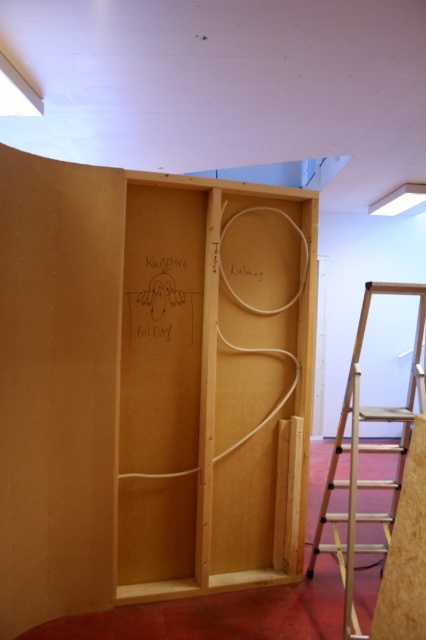
Question: Which object appears closest to the camera in this image?

Choices:
 (A) wooden step ladder at right
 (B) natural wood plywood at center

Answer: (A)

Question: Can you confirm if natural wood plywood at center is positioned below wooden step ladder at right?

Choices:
 (A) no
 (B) yes

Answer: (A)

Question: Does natural wood plywood at center have a greater width compared to wooden step ladder at right?

Choices:
 (A) yes
 (B) no

Answer: (A)

Question: Does natural wood plywood at center appear over wooden step ladder at right?

Choices:
 (A) yes
 (B) no

Answer: (A)